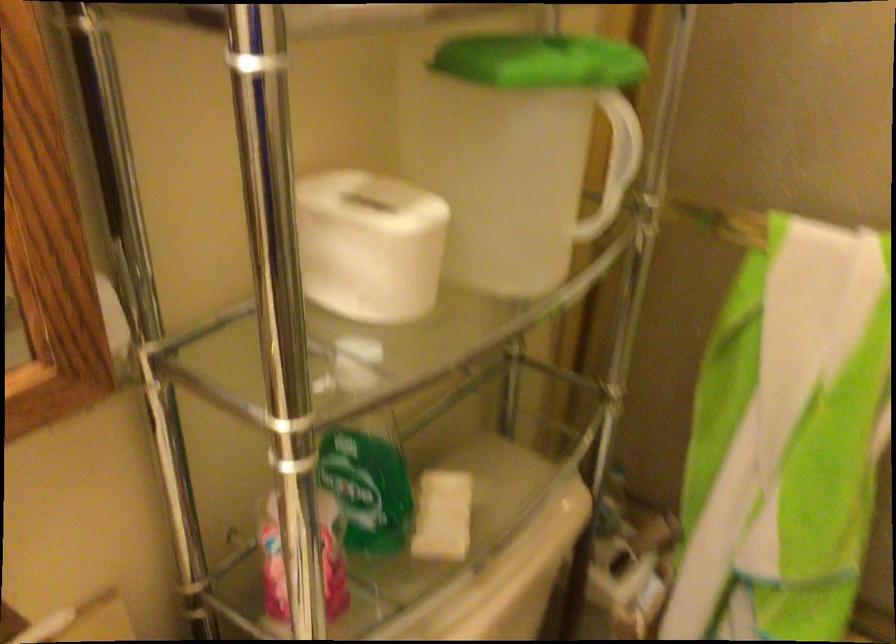
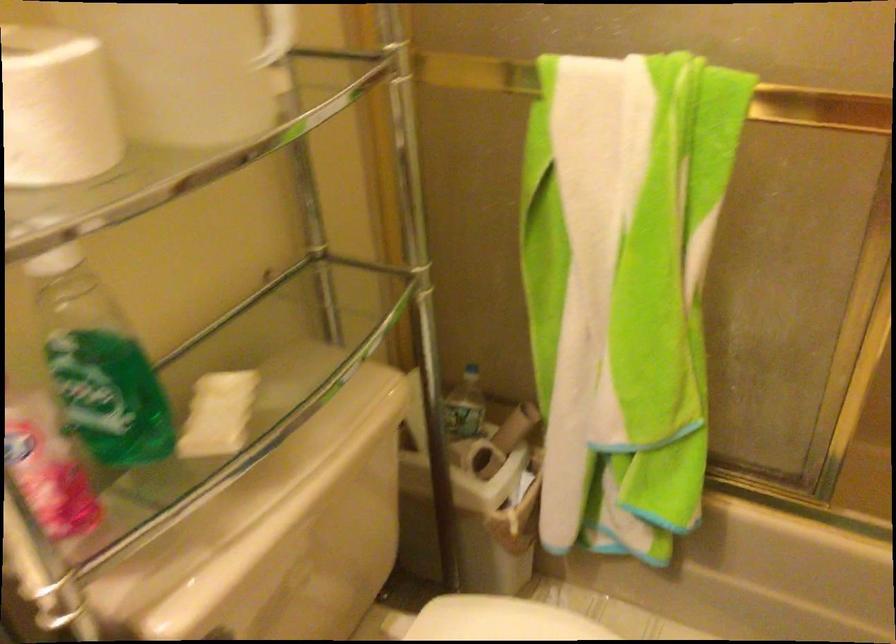
Find the pixel in the second image that matches (738,482) in the first image.

(575, 353)